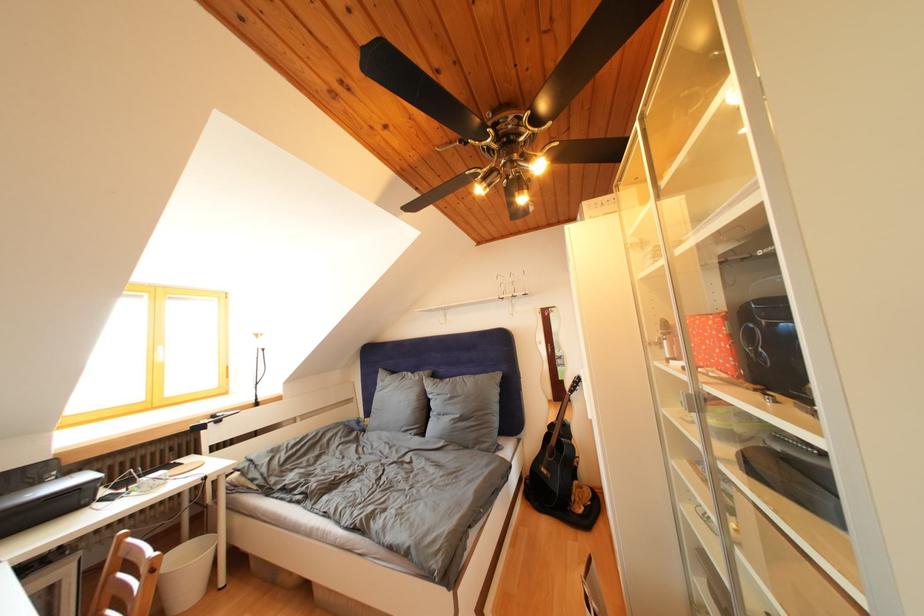
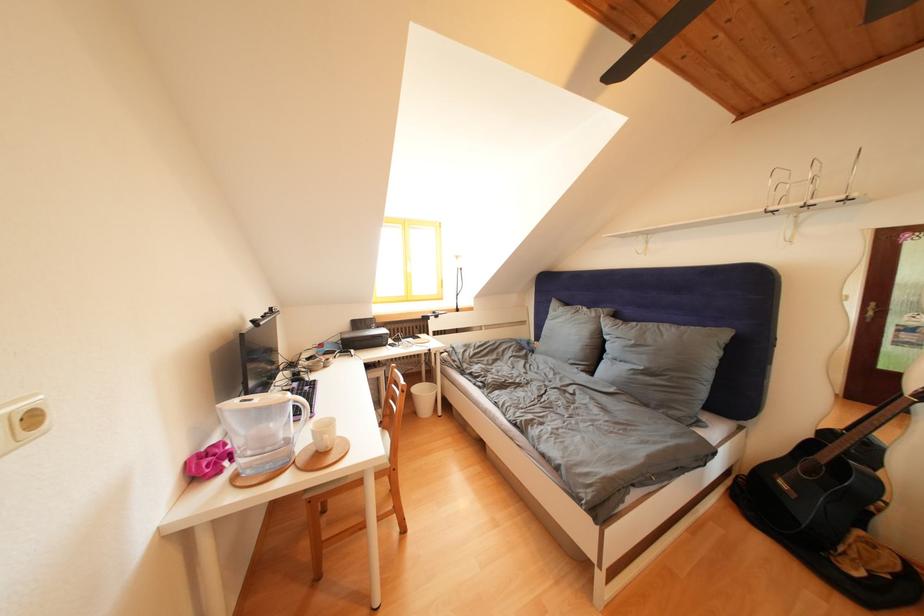
Find the pixel in the second image that matches [552,476] in the first image.

(791, 488)